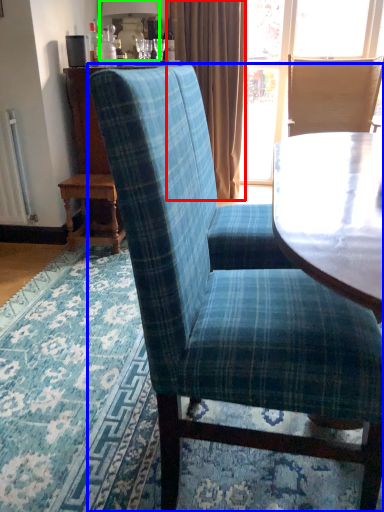
Question: Estimate the real-world distances between objects in this image. Which object is farther from curtain (highlighted by a red box), chair (highlighted by a blue box) or lamp (highlighted by a green box)?

Choices:
 (A) chair
 (B) lamp

Answer: (A)